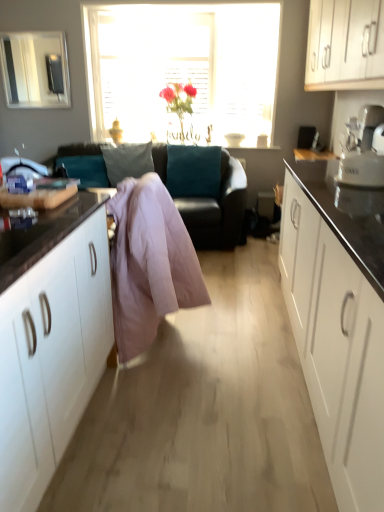
Locate an element on the screen. This screenshot has height=512, width=384. translucent glass vase at center is located at coordinates (183, 65).

Locate an element on the screen. The image size is (384, 512). clear glass window screen at upper left is located at coordinates (35, 69).

The width and height of the screenshot is (384, 512). Describe the element at coordinates (149, 263) in the screenshot. I see `light pink fabric at center` at that location.

In order to click on translucent glass vase at center in this screenshot , I will do `click(183, 65)`.

Is clear glass window screen at upper left surrounding white glossy cabinets at upper right?

No.

Is the position of clear glass window screen at upper left more distant than that of white glossy cabinets at upper right?

Yes, it is behind white glossy cabinets at upper right.

Is clear glass window screen at upper left shorter than white glossy cabinets at upper right?

Yes.

In the scene shown: How far apart are clear glass window screen at upper left and white glossy cabinets at upper right?

clear glass window screen at upper left and white glossy cabinets at upper right are 9.25 feet apart from each other.

In terms of height, does teal leather couch at center look taller or shorter compared to clear glass window screen at upper left?

teal leather couch at center is taller than clear glass window screen at upper left.

From the image's perspective, does teal leather couch at center appear lower than clear glass window screen at upper left?

Correct, teal leather couch at center appears lower than clear glass window screen at upper left in the image.

From a real-world perspective, is teal leather couch at center physically located above or below clear glass window screen at upper left?

teal leather couch at center is below clear glass window screen at upper left.

Is teal leather couch at center positioned far away from clear glass window screen at upper left?

Yes, teal leather couch at center and clear glass window screen at upper left are located far from each other.

Does clear glass window screen at upper left have a lesser width compared to light pink fabric at center?

Indeed, clear glass window screen at upper left has a lesser width compared to light pink fabric at center.

Who is shorter, clear glass window screen at upper left or light pink fabric at center?

clear glass window screen at upper left is shorter.

Is white glossy cabinets at upper right next to teal leather couch at center?

No, white glossy cabinets at upper right is not making contact with teal leather couch at center.

Identify the location of studio couch that is below the white glossy cabinets at upper right (from the image's perspective). The width and height of the screenshot is (384, 512). (218, 210).

From the image's perspective, is white glossy cabinets at upper right below teal leather couch at center?

No, from the image's perspective, white glossy cabinets at upper right is not beneath teal leather couch at center.

In terms of width, does white glossy cabinets at upper right look wider or thinner when compared to teal leather couch at center?

In the image, white glossy cabinets at upper right appears to be more narrow than teal leather couch at center.

Based on their sizes in the image, would you say light pink fabric at center is bigger or smaller than clear glass window screen at upper left?

In the image, light pink fabric at center appears to be larger than clear glass window screen at upper left.

Is clear glass window screen at upper left a part of light pink fabric at center?

No, clear glass window screen at upper left is not a part of light pink fabric at center.

Is light pink fabric at center behind clear glass window screen at upper left?

No, light pink fabric at center is closer to the camera.

From the image's perspective, between light pink fabric at center and clear glass window screen at upper left, who is located below?

light pink fabric at center appears lower in the image.

The width and height of the screenshot is (384, 512). I want to click on blanket in front of the teal leather couch at center, so click(149, 263).

How different are the orientations of teal leather couch at center and light pink fabric at center in degrees?

The facing directions of teal leather couch at center and light pink fabric at center are 90.6 degrees apart.

Is teal leather couch at center at the left side of light pink fabric at center?

Yes, teal leather couch at center is to the left of light pink fabric at center.

Does teal leather couch at center lie in front of light pink fabric at center?

No.

Does translucent glass vase at center have a greater width compared to teal leather couch at center?

In fact, translucent glass vase at center might be narrower than teal leather couch at center.

Does point (269, 36) lie in front of point (205, 246)?

That is False.

Is translucent glass vase at center aimed at teal leather couch at center?

No, translucent glass vase at center is not oriented towards teal leather couch at center.

Is translucent glass vase at center shorter than teal leather couch at center?

→ In fact, translucent glass vase at center may be taller than teal leather couch at center.

What are the coordinates of `cabinetry below the clear glass window screen at upper left (from the image's perspective)` in the screenshot? It's located at 345,45.

Image resolution: width=384 pixels, height=512 pixels. Find the location of `studio couch in front of the clear glass window screen at upper left`. studio couch in front of the clear glass window screen at upper left is located at coordinates pos(218,210).

Which object lies nearer to the anchor point light pink fabric at center, translucent glass vase at center or clear glass window screen at upper left?

Based on the image, translucent glass vase at center appears to be nearer to light pink fabric at center.

When comparing their distances from translucent glass vase at center, does teal leather couch at center or white glossy cabinets at upper right seem closer?

teal leather couch at center.

Estimate the real-world distances between objects in this image. Which object is further from translucent glass vase at center, white glossy cabinets at upper right or light pink fabric at center?

light pink fabric at center is further to translucent glass vase at center.

From the image, which object appears to be farther from teal leather couch at center, light pink fabric at center or translucent glass vase at center?

Based on the image, light pink fabric at center appears to be further to teal leather couch at center.

Which object lies nearer to the anchor point clear glass window screen at upper left, white glossy cabinets at upper right or light pink fabric at center?

white glossy cabinets at upper right lies closer to clear glass window screen at upper left than the other object.

Considering their positions, is white glossy cabinets at upper right positioned closer to clear glass window screen at upper left than teal leather couch at center?

teal leather couch at center lies closer to clear glass window screen at upper left than the other object.

Considering their positions, is clear glass window screen at upper left positioned further to white glossy cabinets at upper right than light pink fabric at center?

The object further to white glossy cabinets at upper right is clear glass window screen at upper left.

Considering their positions, is teal leather couch at center positioned closer to light pink fabric at center than translucent glass vase at center?

The object closer to light pink fabric at center is teal leather couch at center.

You are a GUI agent. You are given a task and a screenshot of the screen. Output one action in this format:
    pyautogui.click(x=<x>, y=<y>)
    Task: Click on the studio couch between white glossy cabinets at upper right and clear glass window screen at upper left in the front-back direction
    
    Given the screenshot: What is the action you would take?
    pyautogui.click(x=218, y=210)

Locate an element on the screen. studio couch between light pink fabric at center and translucent glass vase at center from front to back is located at coordinates (218, 210).

At what (x,y) coordinates should I click in order to perform the action: click on window located between white glossy cabinets at upper right and clear glass window screen at upper left in the depth direction. Please return your answer as a coordinate pair (x, y). This screenshot has width=384, height=512. Looking at the image, I should click on coord(183,65).

Identify the location of blanket positioned between white glossy cabinets at upper right and clear glass window screen at upper left from near to far. This screenshot has height=512, width=384. (149, 263).